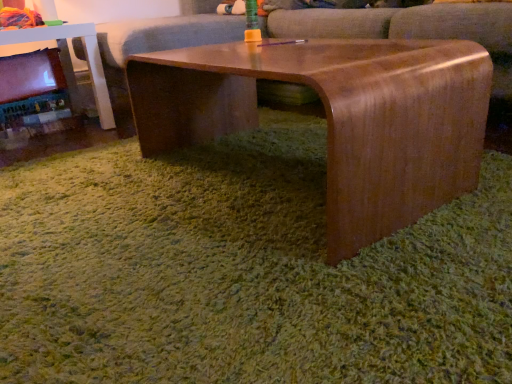
Question: From a real-world perspective, is wooden table at left positioned above or below wooden couch at center?

Choices:
 (A) below
 (B) above

Answer: (A)

Question: Is point click(x=12, y=36) positioned closer to the camera than point click(x=347, y=16)?

Choices:
 (A) farther
 (B) closer

Answer: (A)

Question: Which object is positioned closest to the satin wood swivel chair at center?

Choices:
 (A) matte black fireplace at left
 (B) wooden couch at center
 (C) wooden table at left
 (D) satin wood coffee table at center

Answer: (B)

Question: Estimate the real-world distances between objects in this image. Which object is closer to the wooden table at left?

Choices:
 (A) wooden couch at center
 (B) matte black fireplace at left
 (C) satin wood swivel chair at center
 (D) satin wood coffee table at center

Answer: (B)